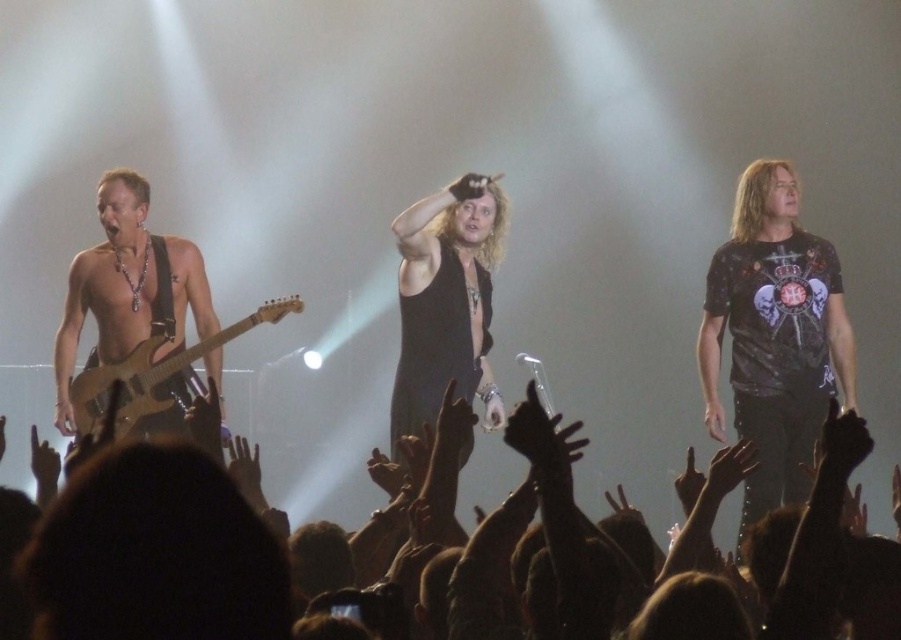
Question: Which point is farther from the camera taking this photo?

Choices:
 (A) (799, 228)
 (B) (142, 211)

Answer: (B)

Question: Based on their relative distances, which object is farther from the wooden electric guitar at left?

Choices:
 (A) dark gray printed t-shirt at right
 (B) black leather jacket at lower center

Answer: (A)

Question: Is black leather jacket at lower center positioned behind wooden electric guitar at left?

Choices:
 (A) yes
 (B) no

Answer: (B)

Question: Does dark gray printed t-shirt at right have a greater width compared to wooden electric guitar at left?

Choices:
 (A) yes
 (B) no

Answer: (B)

Question: Which point is farther to the camera?

Choices:
 (A) wooden electric guitar at left
 (B) shiny silver guitar at left

Answer: (B)

Question: Does black leather jacket at lower center appear over dark gray printed t-shirt at right?

Choices:
 (A) yes
 (B) no

Answer: (B)